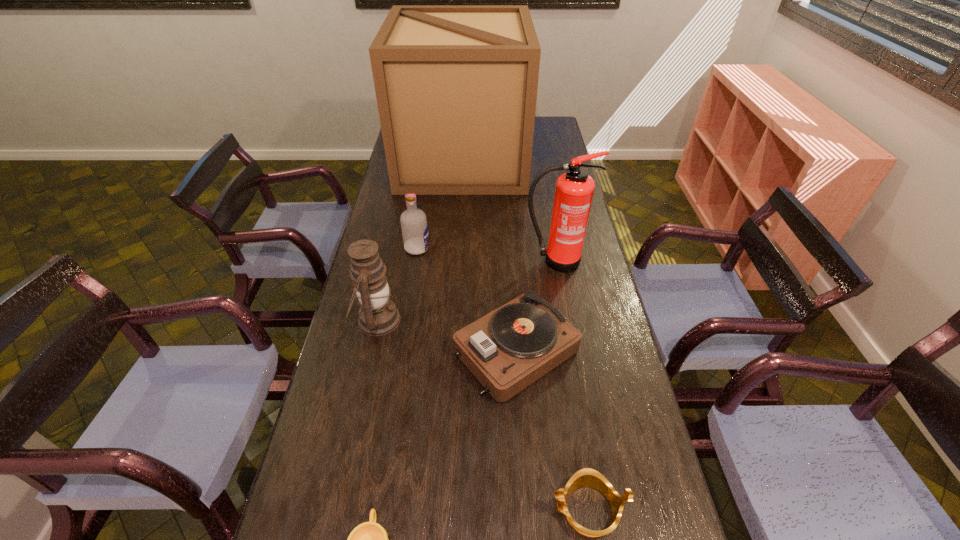
Locate an element on the screen. vacant space located 0.100m on the right of the record player is located at coordinates pos(613,351).

Where is `object present at the far edge`? object present at the far edge is located at coordinates (456, 86).

Where is `box present at the left edge`? box present at the left edge is located at coordinates (456, 86).

At what (x,y) coordinates should I click in order to perform the action: click on oil lamp located at the left edge. Please return your answer as a coordinate pair (x, y). Looking at the image, I should click on (378, 315).

This screenshot has width=960, height=540. In order to click on vodka that is positioned at the left edge in this screenshot , I will do `click(414, 225)`.

Locate an element on the screen. The height and width of the screenshot is (540, 960). fire extinguisher at the right edge is located at coordinates (574, 189).

Find the location of a particular element. The image size is (960, 540). record player at the right edge is located at coordinates (510, 348).

You are a GUI agent. You are given a task and a screenshot of the screen. Output one action in this format:
    pyautogui.click(x=<x>, y=<y>)
    Task: Click on the object at the far left corner
    
    Given the screenshot: What is the action you would take?
    pyautogui.click(x=456, y=86)

In order to click on vacant region at the left edge of the desktop in this screenshot , I will do `click(391, 345)`.

Find the location of `free space at the right edge of the desktop`. free space at the right edge of the desktop is located at coordinates (548, 206).